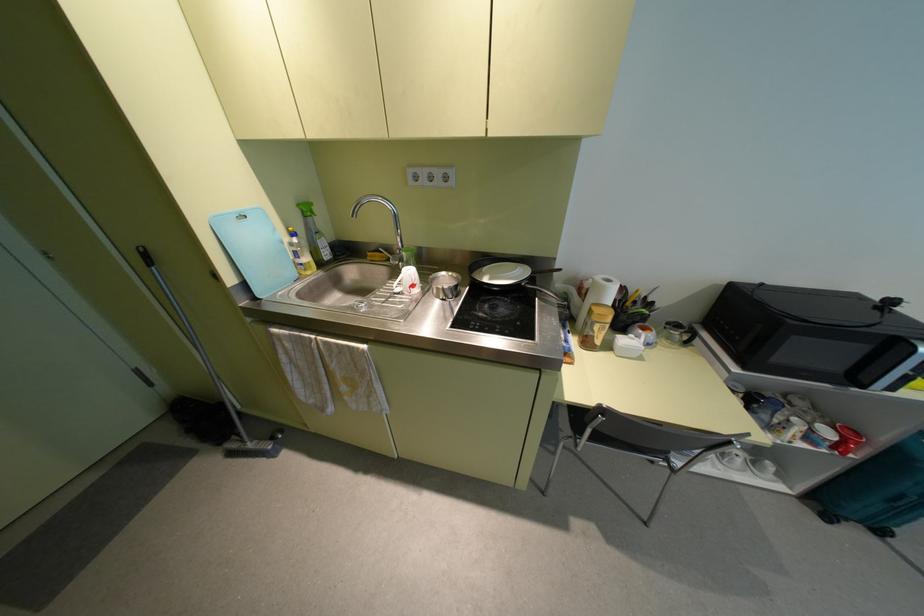
What do you see at coordinates (578, 419) in the screenshot? This screenshot has height=616, width=924. I see `the chair sitting surface` at bounding box center [578, 419].